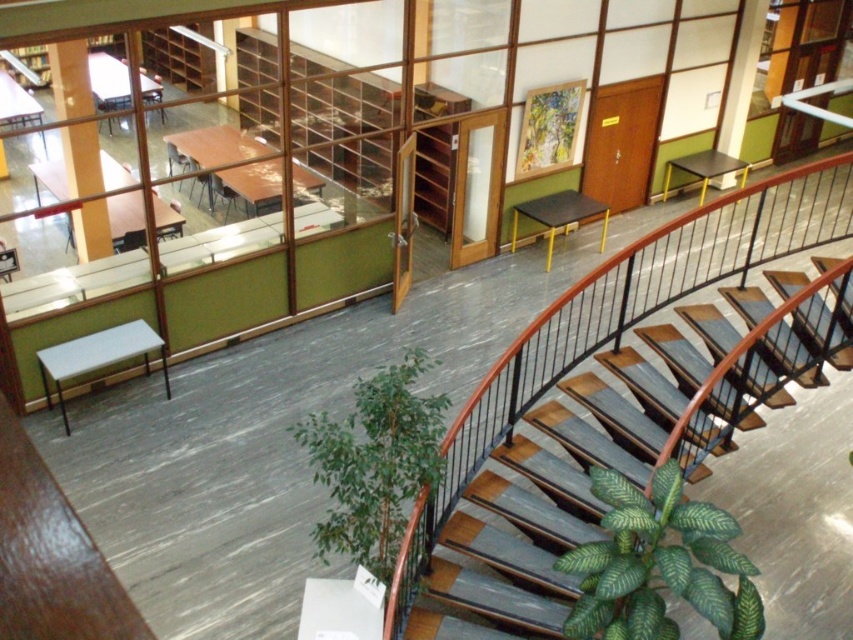
Question: From the image, what is the correct spatial relationship of wooden stairs at center in relation to green glossy plant at bottom right?

Choices:
 (A) below
 (B) above

Answer: (B)

Question: Can you confirm if wooden stairs at center is positioned below matte white pillar at upper right?

Choices:
 (A) yes
 (B) no

Answer: (A)

Question: Which point appears farthest from the camera in this image?

Choices:
 (A) tap(357, 544)
 (B) tap(442, 582)

Answer: (B)

Question: Based on their relative distances, which object is nearer to the green leafy plant at center?

Choices:
 (A) matte white pillar at upper left
 (B) green glossy plant at bottom right
 (C) matte white pillar at upper right
 (D) wooden stairs at center

Answer: (D)

Question: Which point is closer to the camera taking this photo?

Choices:
 (A) (59, 90)
 (B) (701, 358)

Answer: (B)

Question: Does green leafy plant at center appear under matte white pillar at upper right?

Choices:
 (A) no
 (B) yes

Answer: (B)